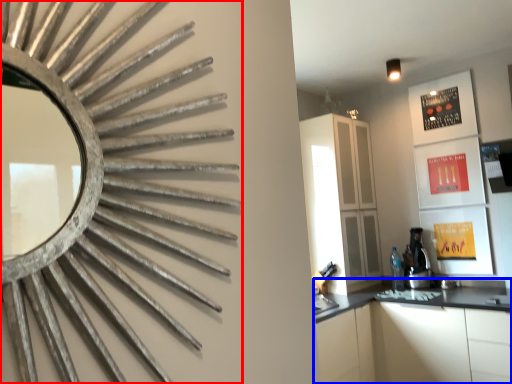
Question: Which object appears farthest to the camera in this image, mirror (highlighted by a red box) or cabinetry (highlighted by a blue box)?

Choices:
 (A) mirror
 (B) cabinetry

Answer: (B)